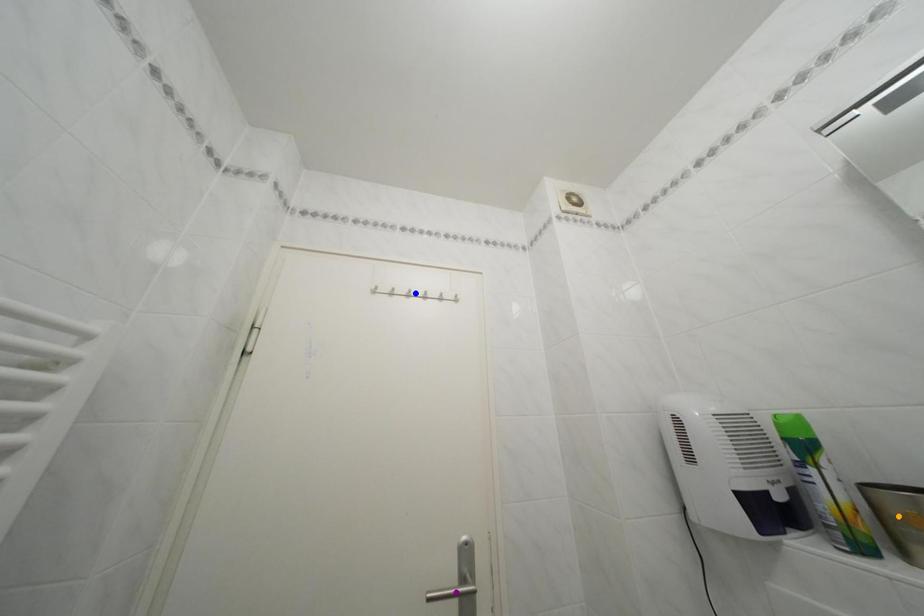
Order these from nearest to farthest:
1. blue point
2. purple point
3. orange point

1. orange point
2. purple point
3. blue point